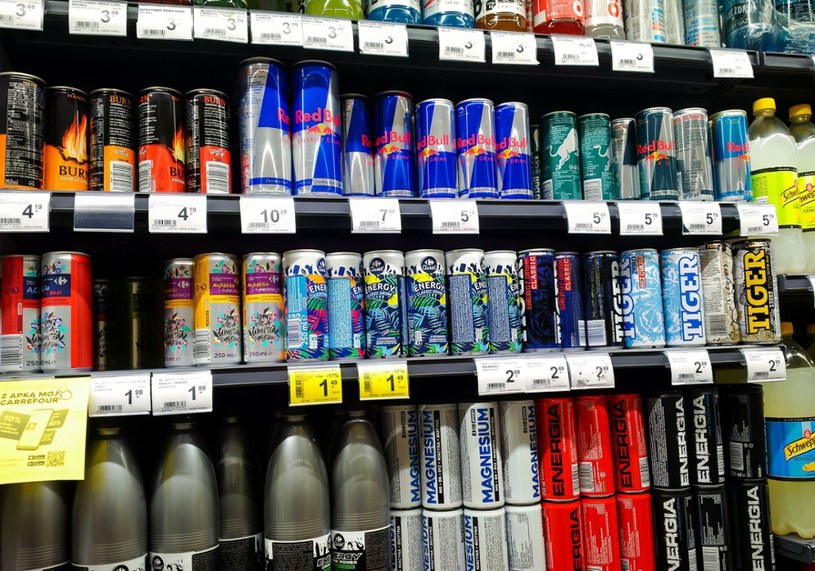
The width and height of the screenshot is (815, 571). What are the coordinates of `black cans on the bottom shelf` in the screenshot? It's located at (663, 461), (706, 468), (741, 459), (756, 521), (710, 534), (681, 529).